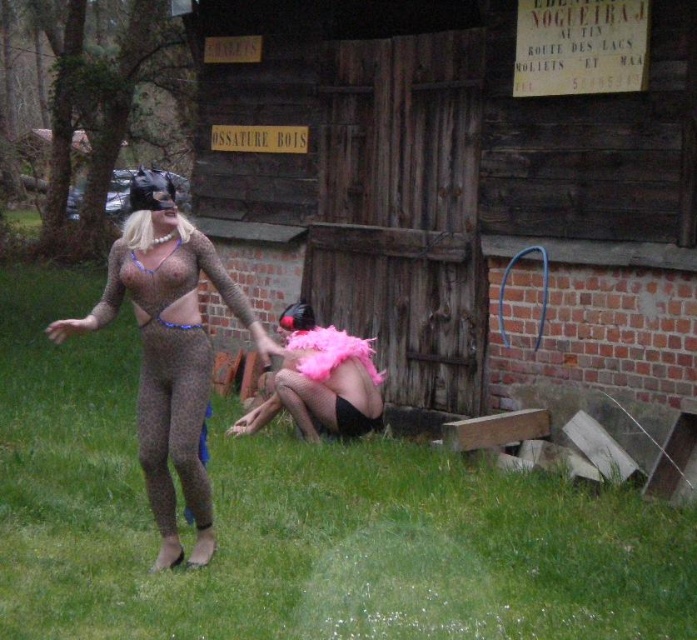
You are a photographer trying to capture a clear shot of the green grass at center and the matte brown bodysuit at center. Which object is shorter in height?

The green grass at center has a lesser height compared to the matte brown bodysuit at center, so the green grass at center is shorter in height.

You are standing at the point marked as point (298, 522) in the image. Which object from the scene are you currently standing on?

You are standing on the green grass at center.

You are a photographer trying to capture a photo of the matte brown bodysuit at center and the green grass at center. Which object is positioned lower in the frame?

The green grass at center is positioned below the matte brown bodysuit at center, so it is lower in the frame.